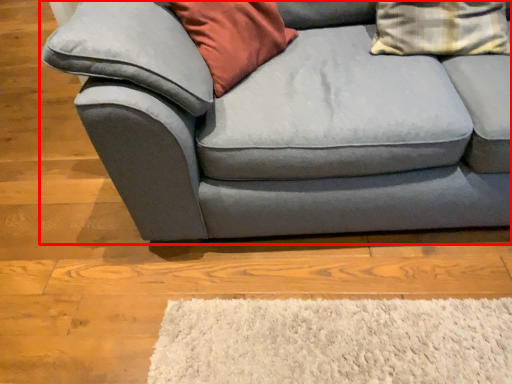
Question: Considering the relative positions of studio couch (annotated by the red box) and pillow in the image provided, where is studio couch (annotated by the red box) located with respect to the staircase?

Choices:
 (A) right
 (B) left

Answer: (B)